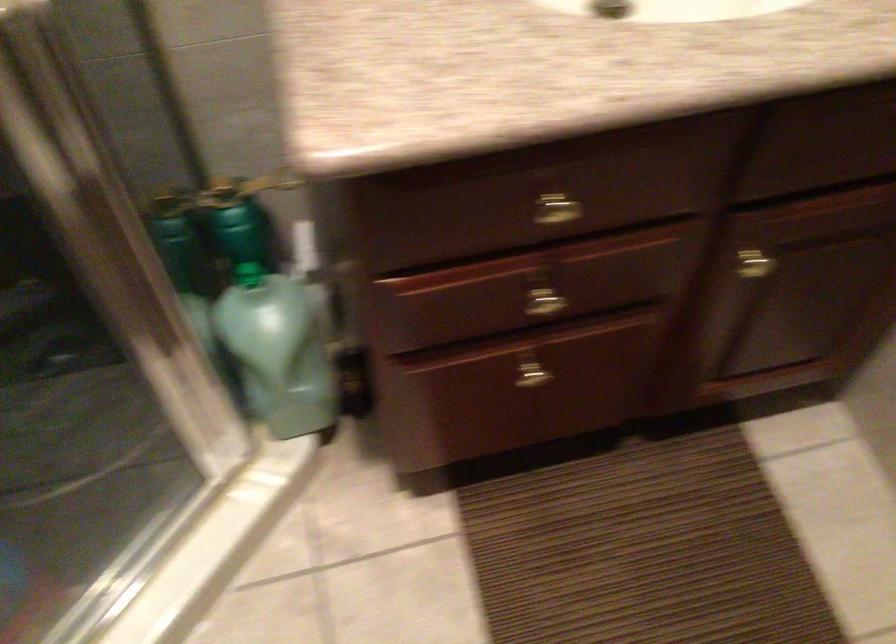
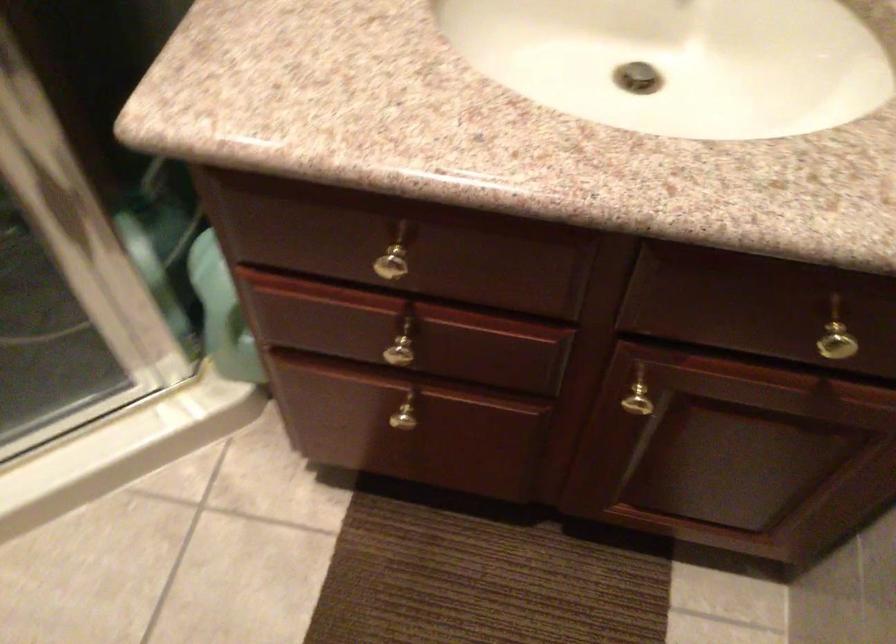
Question: What movement of the cameraman would produce the second image?

Choices:
 (A) Left
 (B) Right
 (C) Forward
 (D) Backward

Answer: (B)